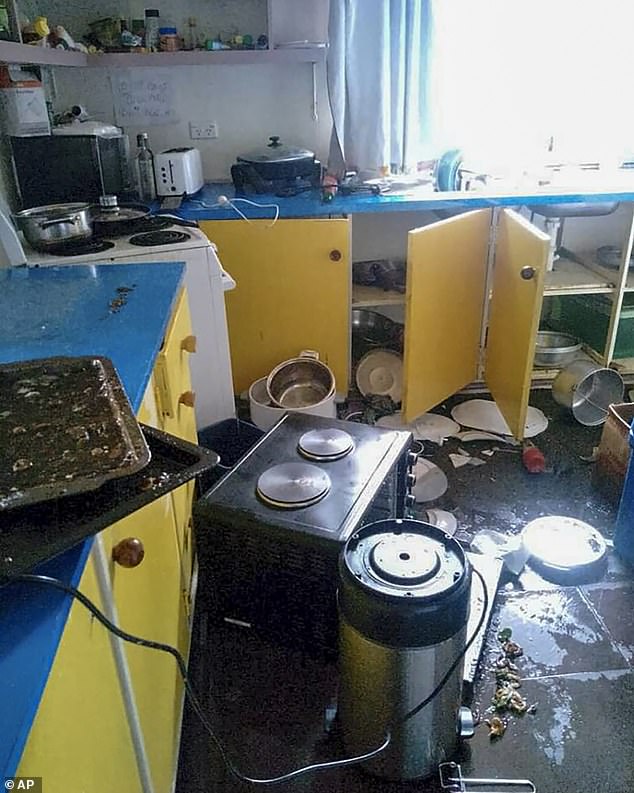
The image size is (634, 793). Identify the location of door knobs. (122, 548), (524, 273).